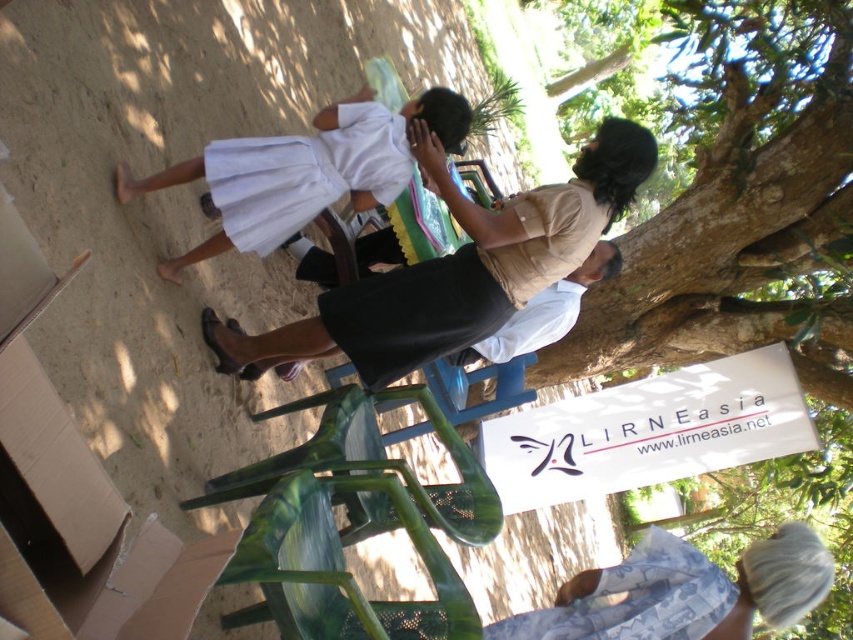
In the scene shown: You are organizing a small event and need to decide where to place a new decorative banner. The banner is the same size as the blue printed fabric at lower right. Based on the scene description, where could you place the banner so it doesn t overwhelm the area compared to the white fabric skirt at left?

Since the white fabric skirt at left is larger in size than the blue printed fabric at lower right, the banner should be placed where the blue printed fabric at lower right is located to maintain proportion and avoid overwhelming the area.

You are standing in the outdoor gathering area and notice the white fabric skirt at left and the blue printed fabric at lower right. Which object is closer to you?

The white fabric skirt at left is closer to you because the blue printed fabric at lower right is behind it.